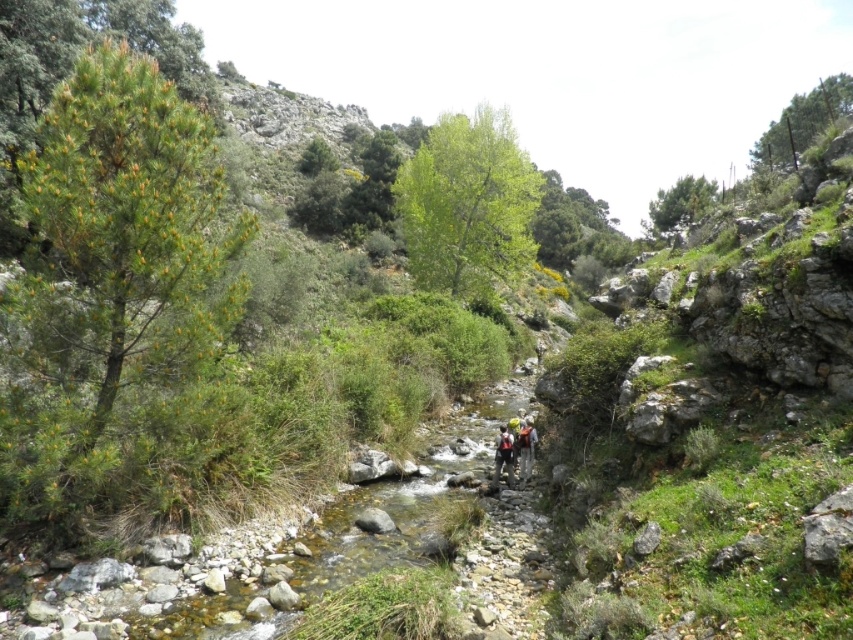
Question: Is smooth rock stream at center positioned at the back of yellow-green fabric backpack at center?

Choices:
 (A) yes
 (B) no

Answer: (B)

Question: Which object is closer to the camera taking this photo?

Choices:
 (A) yellow helmeted person at center
 (B) smooth rock stream at center
 (C) yellow-green fabric backpack at center

Answer: (B)

Question: From the image, what is the correct spatial relationship of yellow helmeted person at center in relation to yellow-green fabric backpack at center?

Choices:
 (A) above
 (B) below

Answer: (A)

Question: Can you confirm if yellow helmeted person at center is wider than yellow-green fabric backpack at center?

Choices:
 (A) no
 (B) yes

Answer: (A)

Question: Which object is the closest to the smooth rock stream at center?

Choices:
 (A) yellow-green fabric backpack at center
 (B) yellow helmeted person at center

Answer: (A)

Question: Which object is positioned closest to the smooth rock stream at center?

Choices:
 (A) yellow helmeted person at center
 (B) yellow-green fabric backpack at center

Answer: (B)